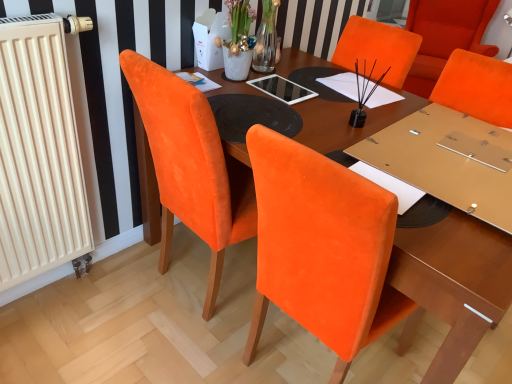
Question: Can you confirm if velvet orange chair at upper right is bigger than beige radiator at left?

Choices:
 (A) yes
 (B) no

Answer: (A)

Question: Is velvet orange chair at upper right beside beige radiator at left?

Choices:
 (A) no
 (B) yes

Answer: (A)

Question: From the image's perspective, is velvet orange chair at upper right under beige radiator at left?

Choices:
 (A) yes
 (B) no

Answer: (B)

Question: Is velvet orange chair at upper right looking in the opposite direction of beige radiator at left?

Choices:
 (A) yes
 (B) no

Answer: (B)

Question: Does velvet orange chair at upper right have a greater width compared to beige radiator at left?

Choices:
 (A) no
 (B) yes

Answer: (B)

Question: Does velvet orange chair at upper right contain beige radiator at left?

Choices:
 (A) yes
 (B) no

Answer: (B)

Question: From the image's perspective, would you say wooden table at center is shown under velvet orange chair at upper right?

Choices:
 (A) yes
 (B) no

Answer: (A)

Question: Is wooden table at center to the left of velvet orange chair at upper right from the viewer's perspective?

Choices:
 (A) yes
 (B) no

Answer: (A)

Question: Is wooden table at center facing towards velvet orange chair at upper right?

Choices:
 (A) yes
 (B) no

Answer: (B)

Question: From the image's perspective, is wooden table at center located above velvet orange chair at upper right?

Choices:
 (A) yes
 (B) no

Answer: (B)

Question: Is wooden table at center turned away from velvet orange chair at upper right?

Choices:
 (A) no
 (B) yes

Answer: (A)

Question: Can you confirm if wooden table at center is positioned to the right of velvet orange chair at upper right?

Choices:
 (A) yes
 (B) no

Answer: (B)

Question: Is velvet orange chair at upper right not inside wooden table at center?

Choices:
 (A) no
 (B) yes

Answer: (B)